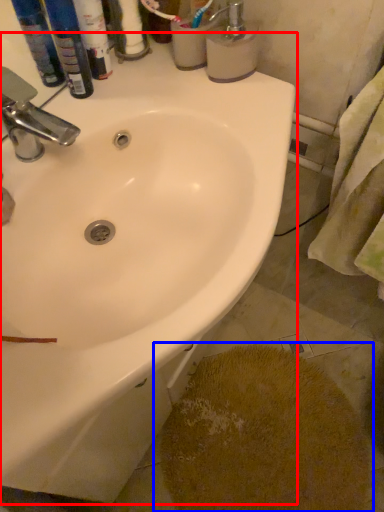
Question: Which point is further to the camera, sink (highlighted by a red box) or powder (highlighted by a blue box)?

Choices:
 (A) sink
 (B) powder

Answer: (B)